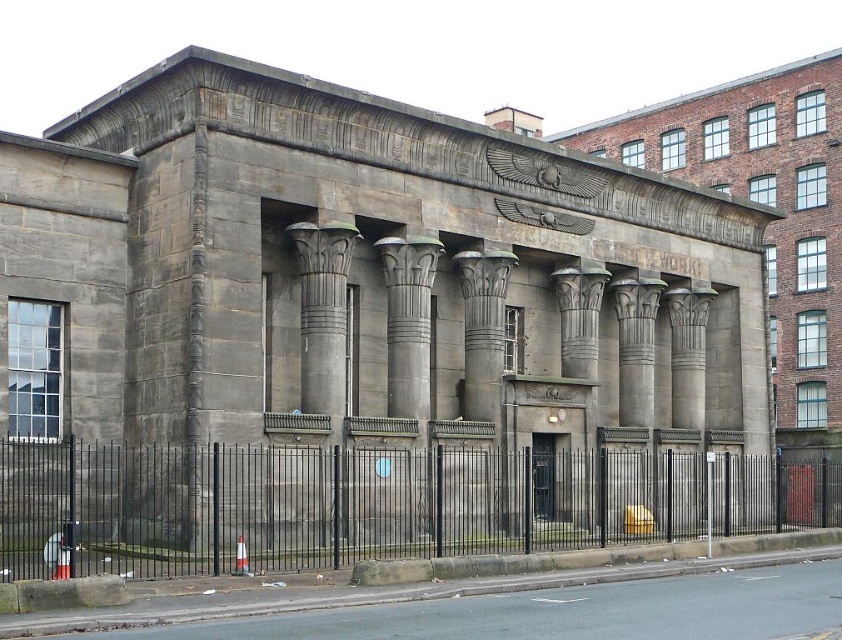
Image resolution: width=842 pixels, height=640 pixels. What do you see at coordinates (326, 504) in the screenshot?
I see `black metal fence at lower center` at bounding box center [326, 504].

In the scene shown: Is black metal fence at lower center to the left of gray stone column at center from the viewer's perspective?

No, black metal fence at lower center is not to the left of gray stone column at center.

Locate an element on the screen. This screenshot has height=640, width=842. black metal fence at lower center is located at coordinates (326, 504).